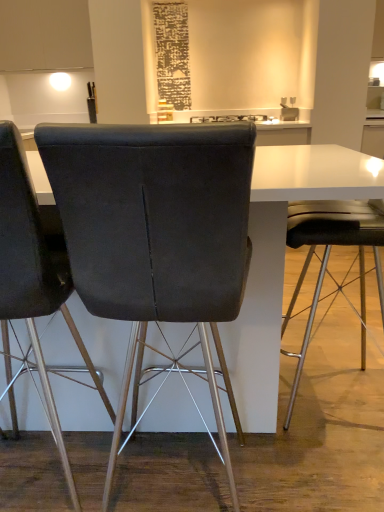
Question: Is black glossy toaster at center surrounded by dark gray fabric chair at center, which is the 2th chair in right-to-left order?

Choices:
 (A) no
 (B) yes

Answer: (A)

Question: Is dark gray fabric chair at center, which is the 2th chair in right-to-left order, beside black glossy toaster at center?

Choices:
 (A) no
 (B) yes

Answer: (A)

Question: Is dark gray fabric chair at center, which ranks as the 2th chair in left-to-right order, taller than black glossy toaster at center?

Choices:
 (A) yes
 (B) no

Answer: (A)

Question: Is dark gray fabric chair at center, which is the 2th chair in right-to-left order, oriented away from black glossy toaster at center?

Choices:
 (A) yes
 (B) no

Answer: (B)

Question: From the image's perspective, would you say dark gray fabric chair at center, which is the 2th chair in right-to-left order, is shown under black glossy toaster at center?

Choices:
 (A) yes
 (B) no

Answer: (A)

Question: Considering the positions of point (283, 117) and point (196, 262), is point (283, 117) closer or farther from the camera than point (196, 262)?

Choices:
 (A) farther
 (B) closer

Answer: (A)

Question: Choose the correct answer: Is matte white sink at upper center inside dark gray fabric chair at center, which ranks as the 2th chair in left-to-right order, or outside it?

Choices:
 (A) inside
 (B) outside

Answer: (B)

Question: Considering the relative positions of matte white sink at upper center and dark gray fabric chair at center, which is the 2th chair in right-to-left order, in the image provided, is matte white sink at upper center to the left or to the right of dark gray fabric chair at center, which is the 2th chair in right-to-left order,?

Choices:
 (A) right
 (B) left

Answer: (A)

Question: From a real-world perspective, relative to dark gray fabric chair at center, which is the 2th chair in right-to-left order, is matte white sink at upper center vertically above or below?

Choices:
 (A) below
 (B) above

Answer: (B)

Question: Considering the positions of matte black chair at right, positioned as the third chair in left-to-right order, and black glossy toaster at center in the image, is matte black chair at right, positioned as the third chair in left-to-right order, wider or thinner than black glossy toaster at center?

Choices:
 (A) wide
 (B) thin

Answer: (B)

Question: Based on their positions, is matte black chair at right, positioned as the third chair in left-to-right order, located to the left or right of black glossy toaster at center?

Choices:
 (A) right
 (B) left

Answer: (A)

Question: From a real-world perspective, is matte black chair at right, the 1th chair positioned from the right, positioned above or below black glossy toaster at center?

Choices:
 (A) above
 (B) below

Answer: (B)

Question: Based on their sizes in the image, would you say matte black chair at right, positioned as the third chair in left-to-right order, is bigger or smaller than black glossy toaster at center?

Choices:
 (A) small
 (B) big

Answer: (B)

Question: From the image's perspective, is dark gray fabric chair at center, which is the 2th chair in right-to-left order, above or below matte white sink at upper center?

Choices:
 (A) below
 (B) above

Answer: (A)

Question: Considering the positions of dark gray fabric chair at center, which is the 2th chair in right-to-left order, and matte white sink at upper center in the image, is dark gray fabric chair at center, which is the 2th chair in right-to-left order, wider or thinner than matte white sink at upper center?

Choices:
 (A) thin
 (B) wide

Answer: (B)